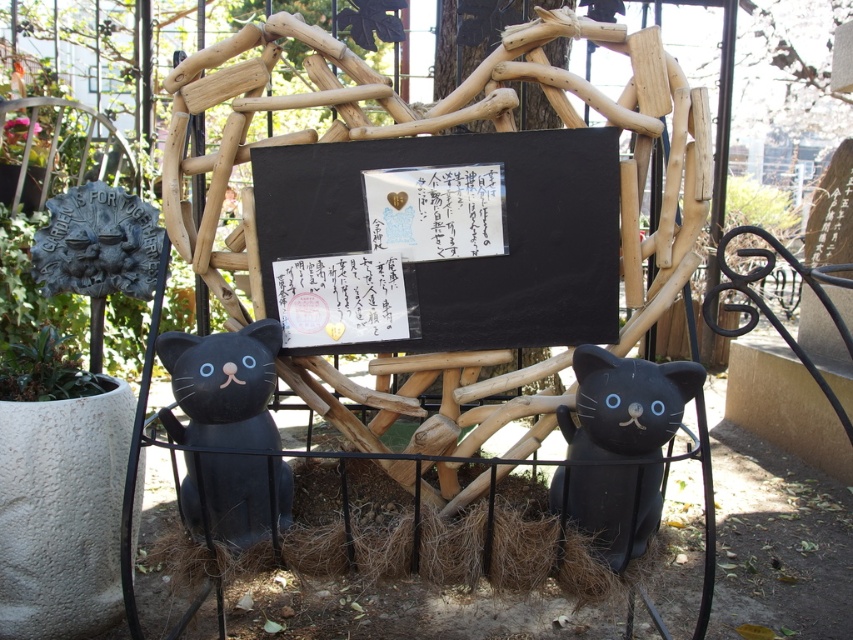
Question: Does matte black cat at left have a larger size compared to green leafy plant at lower left?

Choices:
 (A) no
 (B) yes

Answer: (B)

Question: Which of the following is the farthest from the observer?

Choices:
 (A) brown straw at center
 (B) matte black cat at lower right

Answer: (A)

Question: Which point appears closest to the camera in this image?

Choices:
 (A) (355, 499)
 (B) (25, 384)
 (C) (631, 396)

Answer: (C)

Question: Estimate the real-world distances between objects in this image. Which object is closer to the black matte/blackboard at center?

Choices:
 (A) matte black cat at left
 (B) green leafy plant at lower left

Answer: (A)

Question: Can you confirm if black matte/blackboard at center is thinner than green leafy plant at lower left?

Choices:
 (A) no
 (B) yes

Answer: (A)

Question: Does brown straw at center appear on the left side of green leafy plant at lower left?

Choices:
 (A) no
 (B) yes

Answer: (A)